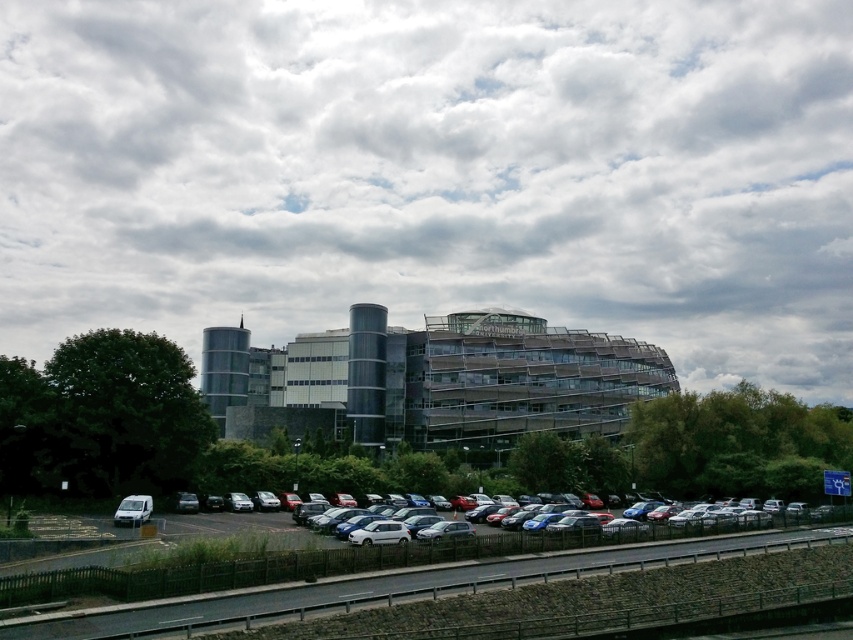
You are standing in front of the Northumbria University building and notice the cloudy sky at upper center and the metallic silver car at center. From your perspective, which object is positioned to the left?

The cloudy sky at upper center is positioned to the left of the metallic silver car at center.

You are a delivery driver who needs to park your truck, which is 20 feet long, between the metallic silver car at center and the white matte van at lower left. Is there enough space between them to fit your truck?

The metallic silver car at center and the white matte van at lower left are 17.89 feet apart from each other. Since your truck is 20 feet long, there isn not enough space between them to fit your truck.